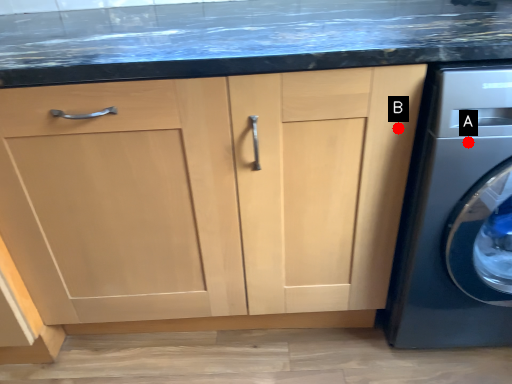
Question: Two points are circled on the image, labeled by A and B beside each circle. Which point appears farthest from the camera in this image?

Choices:
 (A) A is further
 (B) B is further

Answer: (B)